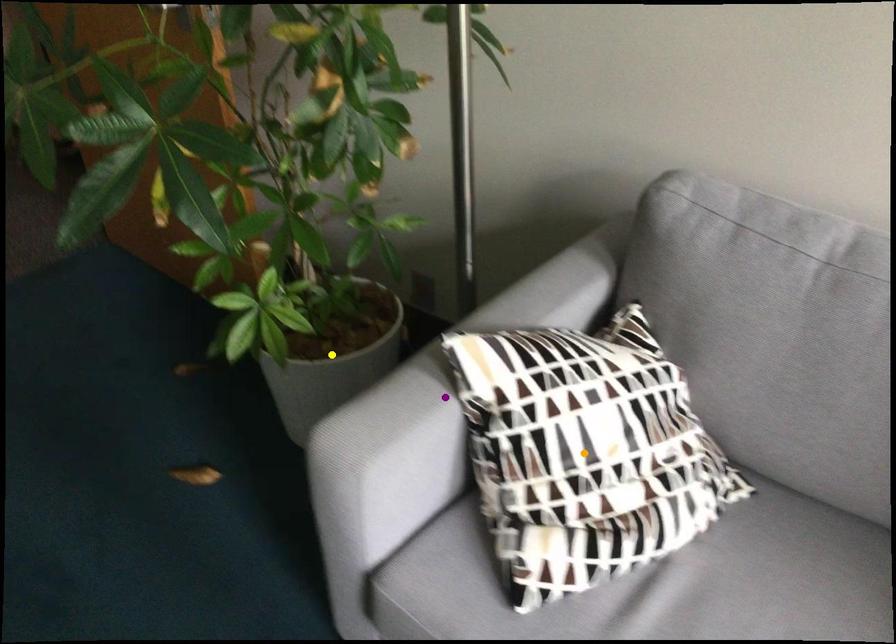
Order these from farthest to nearest:
- orange point
- yellow point
- purple point

yellow point
orange point
purple point